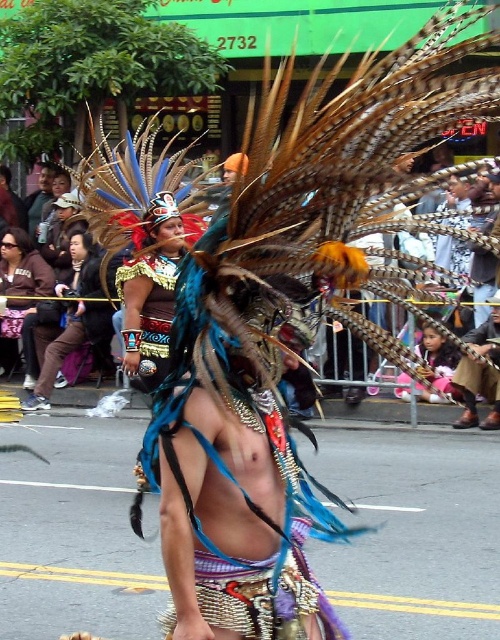
Which is more to the left, leather boots at lower right or matte black headdress at center?

matte black headdress at center is more to the left.

Measure the distance between leather boots at lower right and camera.

The distance of leather boots at lower right from camera is 10.23 meters.

Where is `leather boots at lower right`? leather boots at lower right is located at coordinates (481, 372).